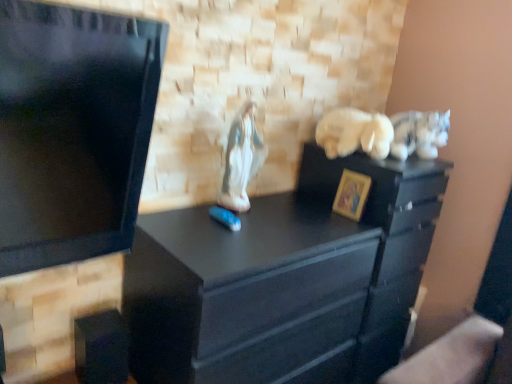
Identify the location of vacant area that lies in front of porcelain statue at center, the first animal viewed from the left. (236, 229).